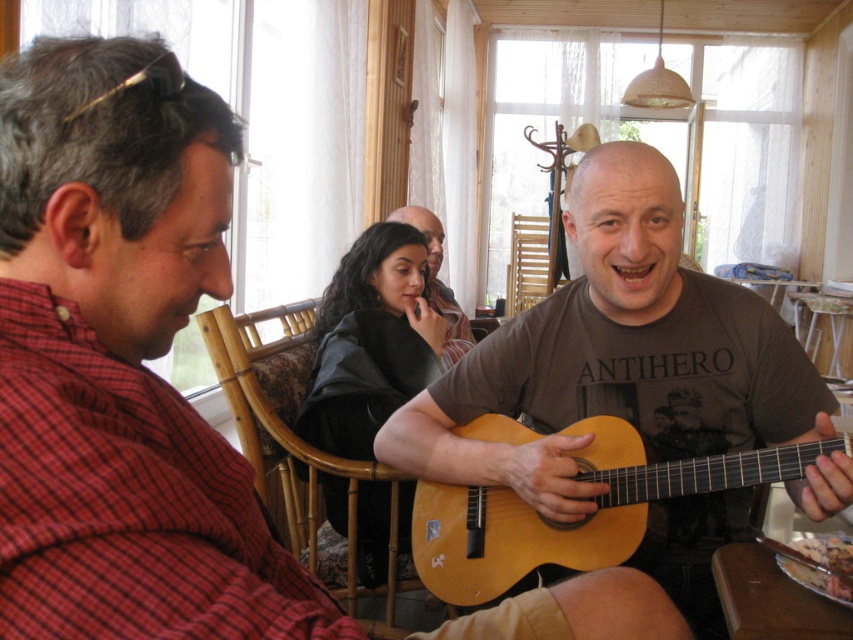
You are a photographer setting up for a group photo. You want to ensure that the matte brown guitar at center and the light brown wooden guitar at center are both in frame. Given that your camera has a focal length of 50mm and the two guitars are 5.03 inches apart, what is the minimum distance you should stand from the guitars to ensure they both fit within a 24mm sensor width? Use the formula sensor width divided by focal length multiplied by distance equals subject size. Assume the required subject size,

The minimum distance should be calculated using the formula distance equals subject size multiplied by focal length divided by sensor width. Plugging in the values, distance equals 5.03 inches multiplied by 50mm divided by 24mm. This results in approximately 10.48 inches. Therefore, standing at least 10.48 inches away ensures both guitars fit within the 24mm sensor width.

You are standing at the entrance of the room and want to walk straight to the matte brown guitar at center. According to the coordinates provided, in which direction should you move relative to your current position?

The matte brown guitar at center is located at coordinates point (616, 355). Since you are at the entrance, moving towards the center of the room would align with the guitar position, so you should move forward towards the center of the room.

You are planning to place a matte brown guitar at center and a light brown wooden guitar at center on a shelf. Which guitar should you place first if you want to arrange them from largest to smallest?

The matte brown guitar at center should be placed first since it has a larger size compared to the light brown wooden guitar at center.